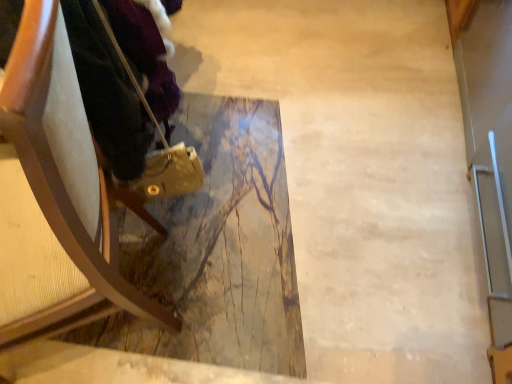
What are the coordinates of `free location to the right of brown leather chair at lower left` in the screenshot? It's located at tap(268, 295).